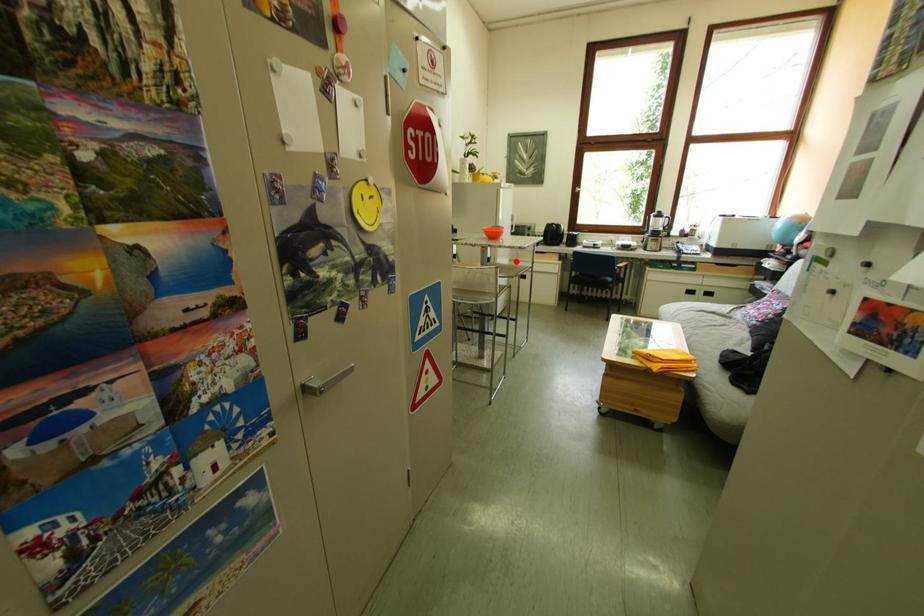
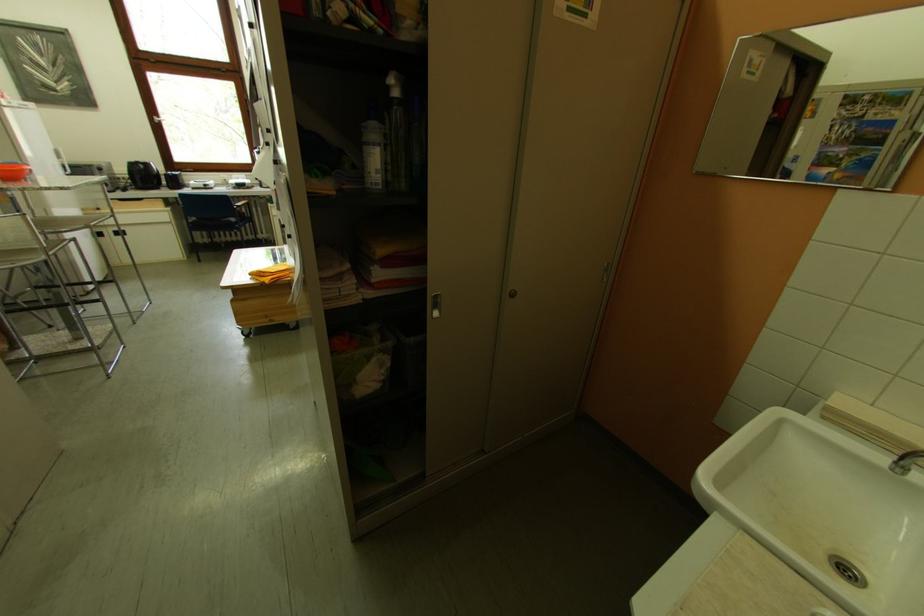
Find the pixel in the second image that matches the highlighted location in the first image.

(79, 214)